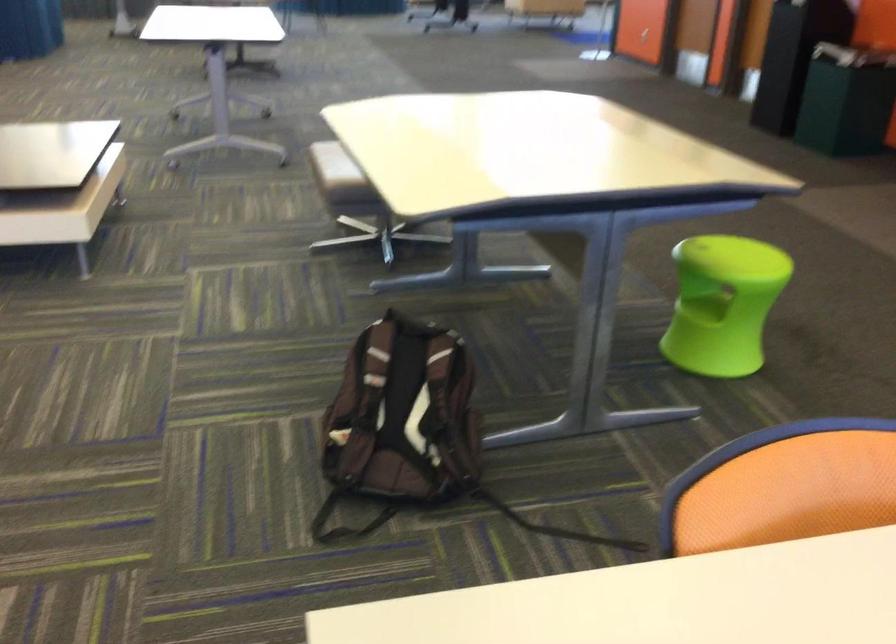
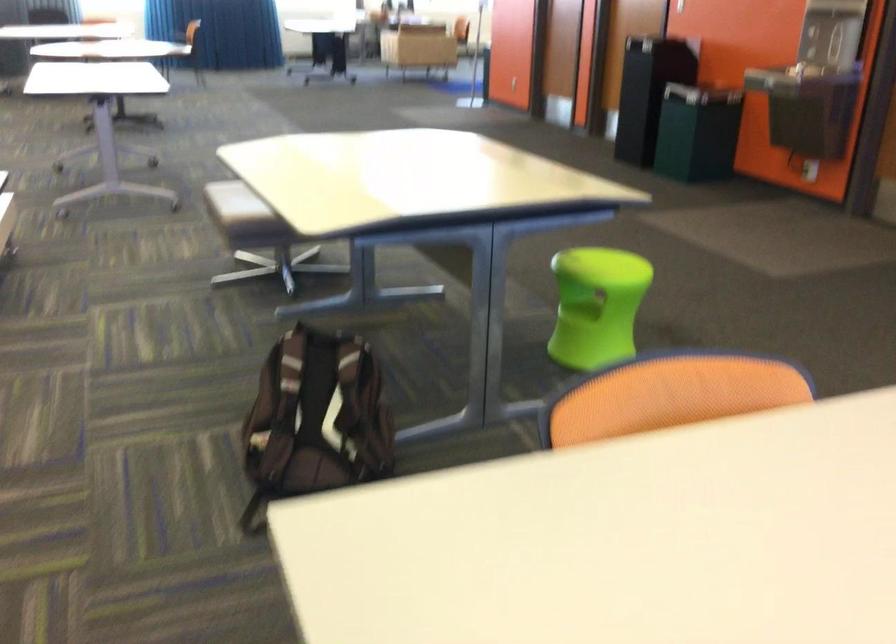
Question: The camera is either moving clockwise (left) or counter-clockwise (right) around the object. The first image is from the beginning of the video and the second image is from the end. Is the camera moving left or right when shooting the video?

Choices:
 (A) Left
 (B) Right

Answer: (A)